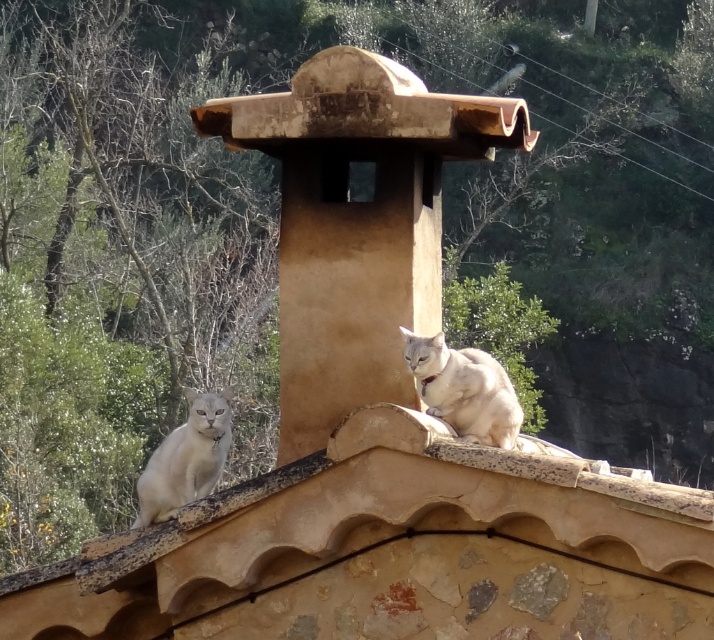
Between point (441, 422) and point (208, 486), which one is positioned in front?

Point (441, 422) is in front.

Is point (548, 586) positioned before point (186, 461)?

Yes, point (548, 586) is closer to viewer.

What do you see at coordinates (396, 550) in the screenshot? The image size is (714, 640). I see `brown textured tile roof at center` at bounding box center [396, 550].

Where is `brown textured tile roof at center`? The image size is (714, 640). brown textured tile roof at center is located at coordinates (396, 550).

Identify the location of white fur cat at upper center. (463, 388).

The height and width of the screenshot is (640, 714). I want to click on white fur cat at upper center, so click(463, 388).

This screenshot has height=640, width=714. What are the coordinates of `white fur cat at upper center` in the screenshot? It's located at (463, 388).

The height and width of the screenshot is (640, 714). What do you see at coordinates (396, 550) in the screenshot? I see `brown textured tile roof at center` at bounding box center [396, 550].

Does brown textured tile roof at center have a smaller size compared to white fur cat at upper center?

Incorrect, brown textured tile roof at center is not smaller in size than white fur cat at upper center.

The width and height of the screenshot is (714, 640). What are the coordinates of `brown textured tile roof at center` in the screenshot? It's located at (396, 550).